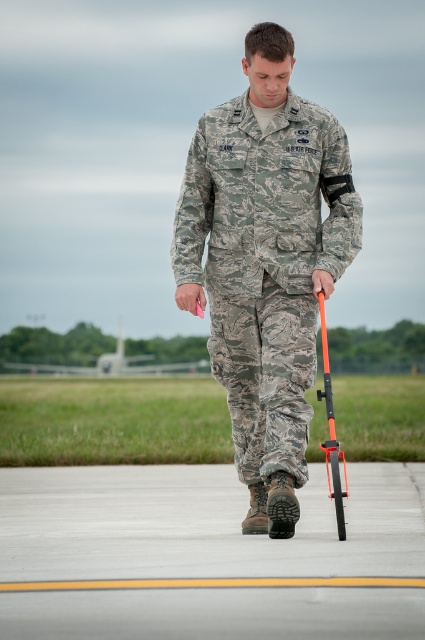
Which is in front, point (362, 486) or point (288, 307)?

Point (288, 307) is more forward.

Which is behind, point (183, 484) or point (354, 227)?

The point (183, 484) is more distant.

Where is `gray concrete tarmac at center`? This screenshot has height=640, width=425. gray concrete tarmac at center is located at coordinates click(206, 554).

Can you confirm if camouflage fabric uniform at center is bigger than orange matte crutch at center?

Correct, camouflage fabric uniform at center is larger in size than orange matte crutch at center.

Between point (268, 419) and point (325, 451), which one is positioned in front?

Positioned in front is point (325, 451).

Identify the location of camouflage fabric uniform at center. (265, 262).

Does gray concrete tarmac at center come behind orange matte crutch at center?

Yes, it is.

Who is more distant from viewer, (x=277, y=547) or (x=320, y=304)?

Positioned behind is point (x=320, y=304).

You are a GUI agent. You are given a task and a screenshot of the screen. Output one action in this format:
    pyautogui.click(x=<x>, y=<y>)
    Task: Click on the gray concrete tarmac at center
    
    Given the screenshot: What is the action you would take?
    pyautogui.click(x=206, y=554)